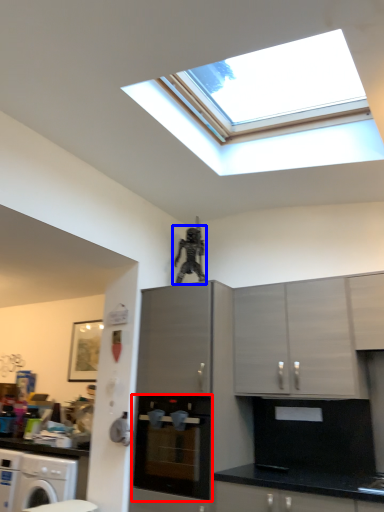
Question: Which object appears farthest to the camera in this image, home appliance (highlighted by a red box) or person (highlighted by a blue box)?

Choices:
 (A) home appliance
 (B) person

Answer: (B)